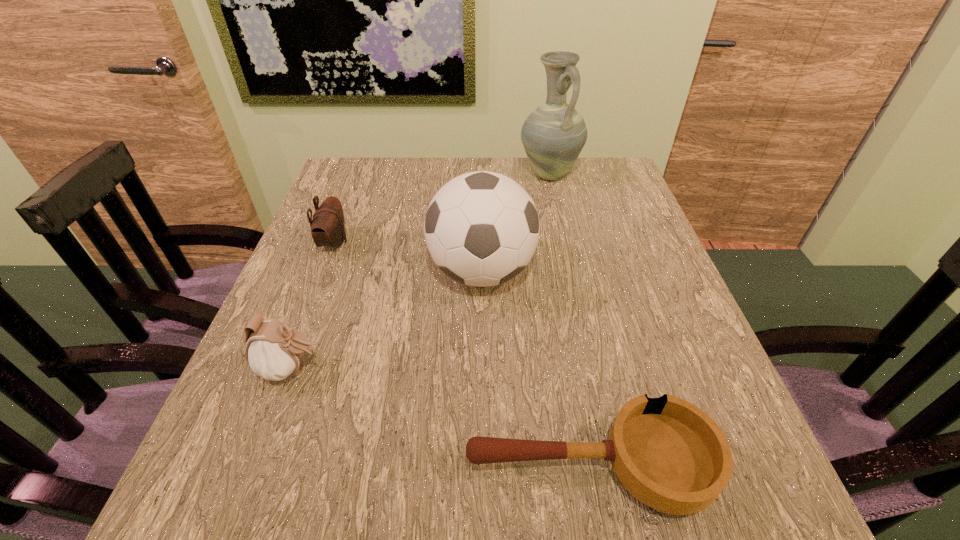
Where is `vacant space situated 0.060m with the flap open on the farther pouch`? Image resolution: width=960 pixels, height=540 pixels. vacant space situated 0.060m with the flap open on the farther pouch is located at coordinates (373, 242).

Locate an element on the screen. The height and width of the screenshot is (540, 960). free point located 0.200m with the handle on the side of the nearest object is located at coordinates (331, 467).

This screenshot has width=960, height=540. In order to click on vacant point located with the handle on the side of the nearest object in this screenshot , I will do `click(365, 467)`.

The height and width of the screenshot is (540, 960). Find the location of `free space located with the handle on the side of the nearest object`. free space located with the handle on the side of the nearest object is located at coordinates (271, 467).

Find the location of a particular element. The image size is (960, 540). object situated at the far edge is located at coordinates (553, 135).

The height and width of the screenshot is (540, 960). What are the coordinates of `object situated at the near edge` in the screenshot? It's located at (669, 454).

At what (x,y) coordinates should I click in order to perform the action: click on pitcher present at the right edge. Please return your answer as a coordinate pair (x, y). Image resolution: width=960 pixels, height=540 pixels. Looking at the image, I should click on (x=553, y=135).

Where is `saucepan that is positioned at the right edge`? This screenshot has height=540, width=960. saucepan that is positioned at the right edge is located at coordinates (669, 454).

Where is `object at the far right corner`? object at the far right corner is located at coordinates (553, 135).

Find the location of a particular element. The image size is (960, 540). object that is at the near right corner is located at coordinates (669, 454).